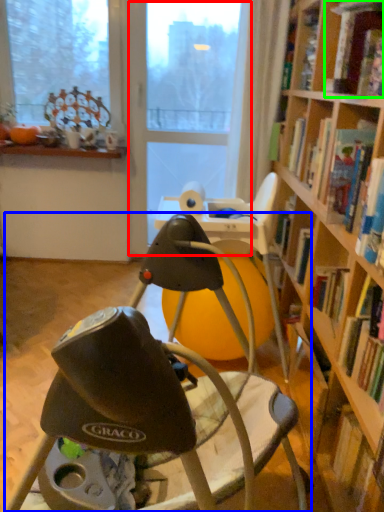
Question: Estimate the real-world distances between objects in this image. Which object is closer to screen door (highlighted by a red box), chair (highlighted by a blue box) or book (highlighted by a green box)?

Choices:
 (A) chair
 (B) book

Answer: (B)